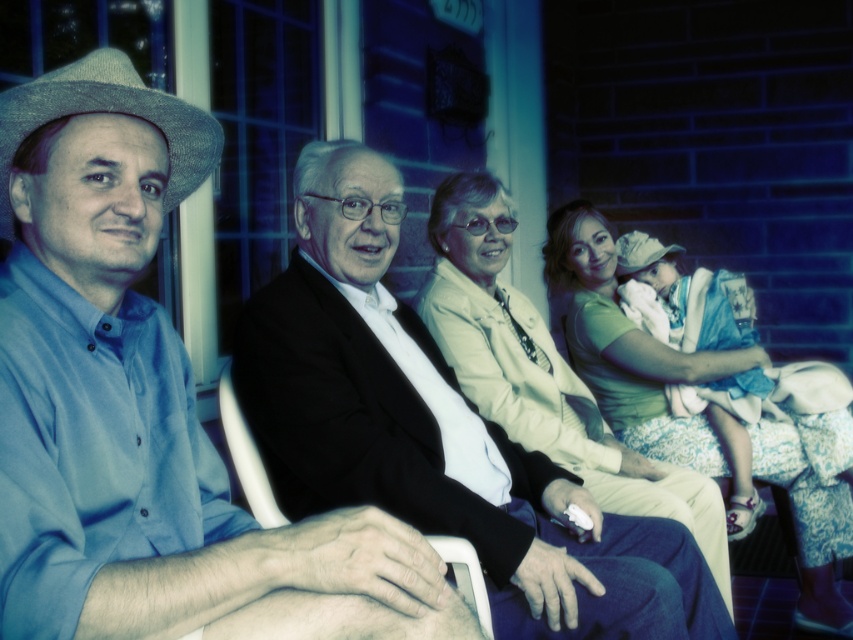
Question: Is matte green shirt at right positioned behind white plastic chair at center?

Choices:
 (A) yes
 (B) no

Answer: (A)

Question: Which of the following is the closest to the observer?

Choices:
 (A) (144, 253)
 (B) (234, 412)

Answer: (A)

Question: Does light beige fabric jacket at center appear on the left side of matte green shirt at right?

Choices:
 (A) yes
 (B) no

Answer: (A)

Question: Among these points, which one is farthest from the camera?

Choices:
 (A) (515, 433)
 (B) (256, 493)
 (C) (38, 371)
 (D) (701, 464)

Answer: (D)

Question: Does blue cotton shirt at left have a lesser width compared to matte green shirt at right?

Choices:
 (A) yes
 (B) no

Answer: (A)

Question: Based on their relative distances, which object is farther from the light beige fabric jacket at center?

Choices:
 (A) blue cotton shirt at left
 (B) white plastic chair at center

Answer: (A)